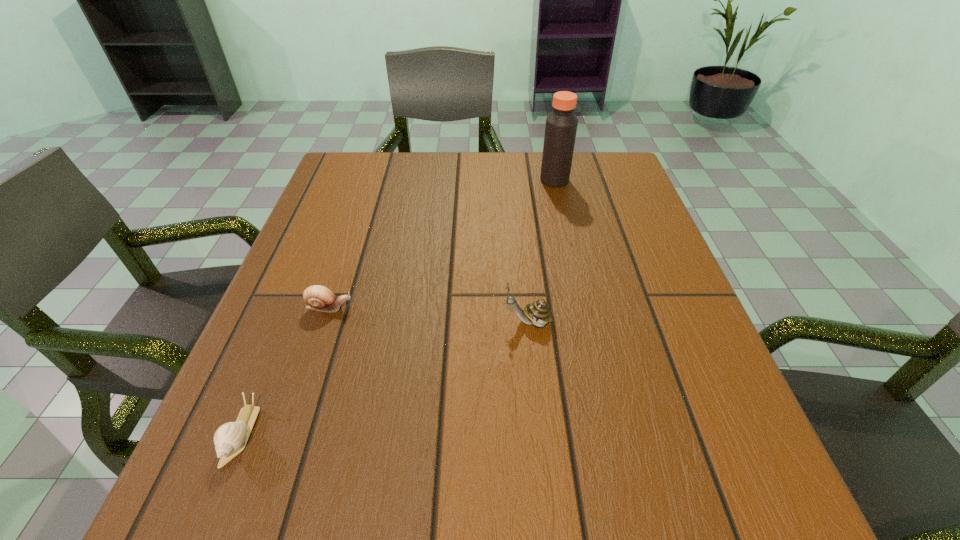
Image resolution: width=960 pixels, height=540 pixels. In the image, there is a desktop. Find the location of `vacant space at the far left corner`. vacant space at the far left corner is located at coordinates (350, 171).

At what (x,y) coordinates should I click in order to perform the action: click on free space at the far right corner of the desktop. Please return your answer as a coordinate pair (x, y). This screenshot has width=960, height=540. Looking at the image, I should click on (597, 184).

This screenshot has width=960, height=540. I want to click on vacant area at the near right corner, so click(x=708, y=512).

You are a GUI agent. You are given a task and a screenshot of the screen. Output one action in this format:
    pyautogui.click(x=<x>, y=<y>)
    Task: Click on the unoccupied area between the nearest escargot and the rightmost object
    The image size is (960, 540).
    Given the screenshot: What is the action you would take?
    pyautogui.click(x=397, y=307)

I want to click on free space between the tallest object and the second object from right to left, so click(x=541, y=251).

Where is `unoccupied area between the vinegar and the third shortest object`? unoccupied area between the vinegar and the third shortest object is located at coordinates (541, 251).

Locate an element on the screen. The width and height of the screenshot is (960, 540). vacant area that lies between the shortest escargot and the third object from right to left is located at coordinates (285, 370).

This screenshot has height=540, width=960. I want to click on empty space that is in between the third object from right to left and the nearest escargot, so click(285, 370).

Identify the location of free space between the second tallest object and the second escargot from left to right. The image size is (960, 540). (428, 314).

Locate an element on the screen. Image resolution: width=960 pixels, height=540 pixels. free space between the leftmost object and the third object from left to right is located at coordinates (385, 378).